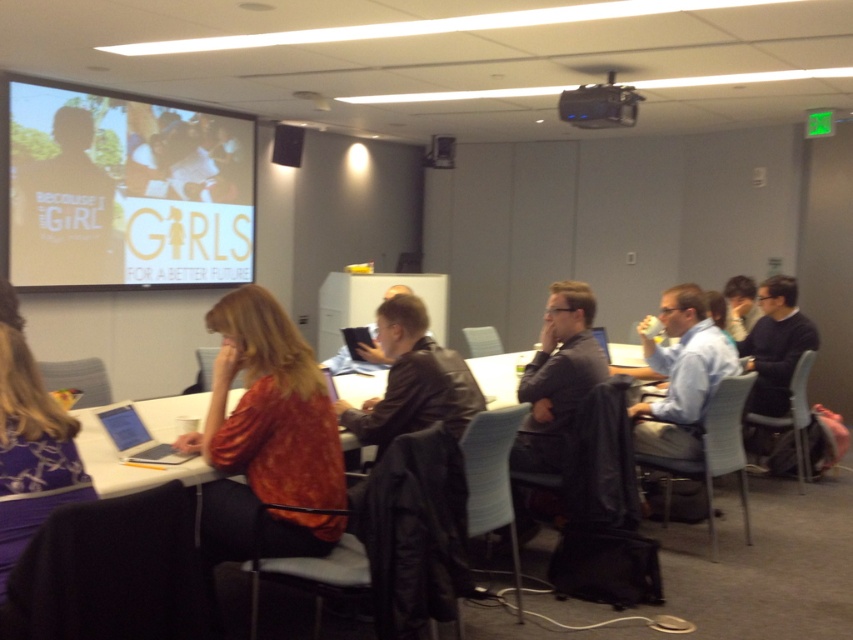
Question: Which object appears farthest from the camera in this image?

Choices:
 (A) black leather jacket at center
 (B) matte blue shirt at right

Answer: (B)

Question: Is leather jacket at center below matte black speaker at upper center?

Choices:
 (A) no
 (B) yes

Answer: (B)

Question: Can you confirm if leather jacket at center is positioned to the right of matte black laptop at center?

Choices:
 (A) yes
 (B) no

Answer: (A)

Question: Considering the real-world distances, which object is closest to the matte black laptop at center?

Choices:
 (A) matte blue shirt at right
 (B) matte black speaker at upper center
 (C) orange textured shirt at center

Answer: (C)

Question: Which object is the closest to the leather jacket at center?

Choices:
 (A) black leather jacket at center
 (B) orange textured shirt at center
 (C) matte black laptop at center

Answer: (B)

Question: In this image, where is orange textured shirt at center located relative to matte black laptop at center?

Choices:
 (A) left
 (B) right

Answer: (B)